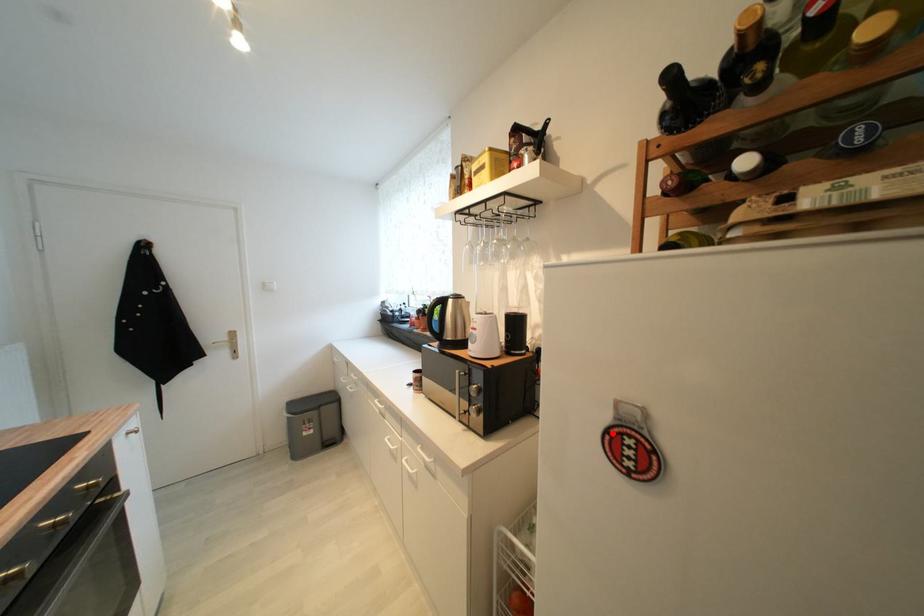
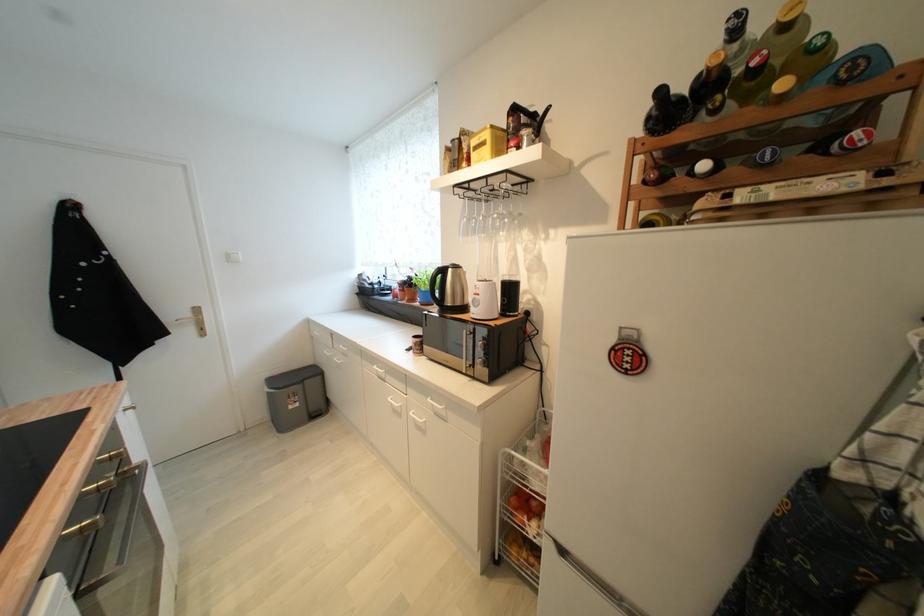
Question: I am providing you with two images of the same scene from different viewpoints. A red point is marked on the first image. Is the red point's position out of view in image 2?

Choices:
 (A) Yes
 (B) No

Answer: (B)